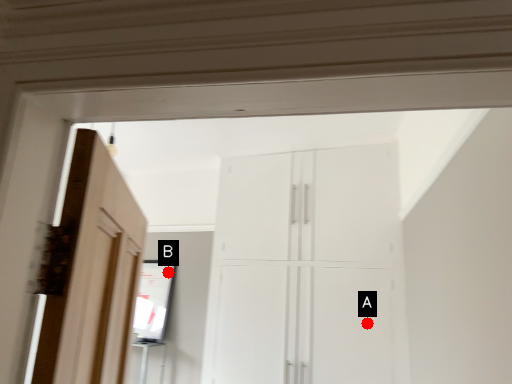
Question: Two points are circled on the image, labeled by A and B beside each circle. Which of the following is the closest to the observer?

Choices:
 (A) A is closer
 (B) B is closer

Answer: (A)